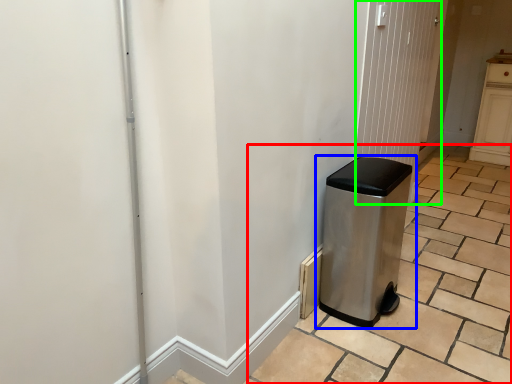
Question: Considering the real-world distances, which object is farthest from tile (highlighted by a red box)? waste container (highlighted by a blue box) or screen door (highlighted by a green box)?

Choices:
 (A) waste container
 (B) screen door

Answer: (B)